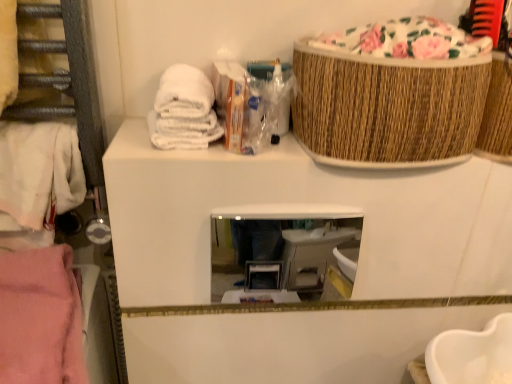
Question: Relative to clear glass mirror at center, is white cotton towel at left, which appears as the 1th clothing when viewed from the top, in front or behind?

Choices:
 (A) front
 (B) behind

Answer: (A)

Question: In terms of size, does white cotton towel at left, which appears as the 1th clothing when viewed from the top, appear bigger or smaller than clear glass mirror at center?

Choices:
 (A) small
 (B) big

Answer: (B)

Question: Which object is positioned farthest from the white cotton towel at left, the second clothing when ordered from bottom to top?

Choices:
 (A) clear glass mirror at center
 (B) woven brown basket at upper right
 (C) pink fabric at left, the second clothing viewed from the top

Answer: (A)

Question: Which of these objects is positioned closest to the white cotton towel at left, which appears as the 1th clothing when viewed from the top?

Choices:
 (A) woven brown basket at upper right
 (B) pink fabric at left, the second clothing viewed from the top
 (C) clear glass mirror at center

Answer: (B)